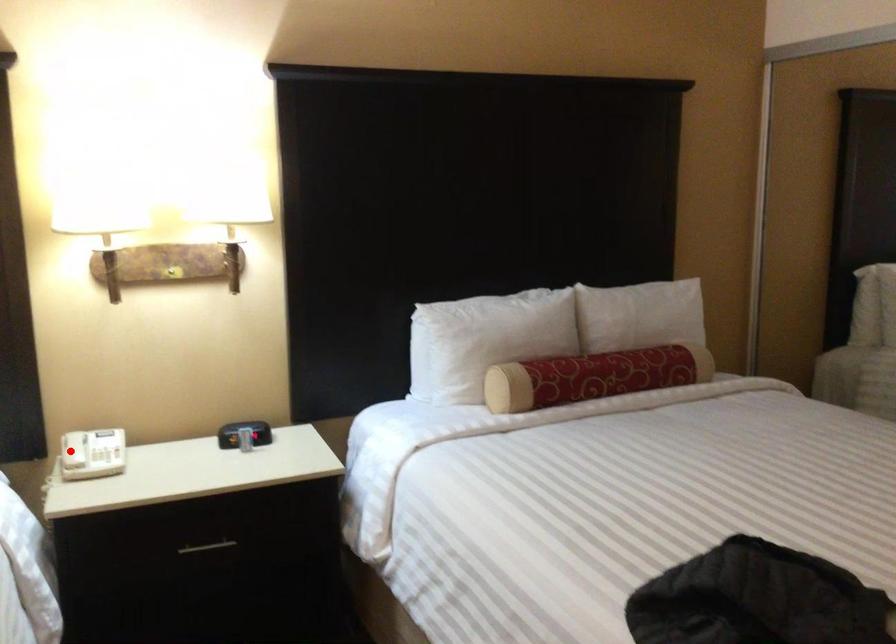
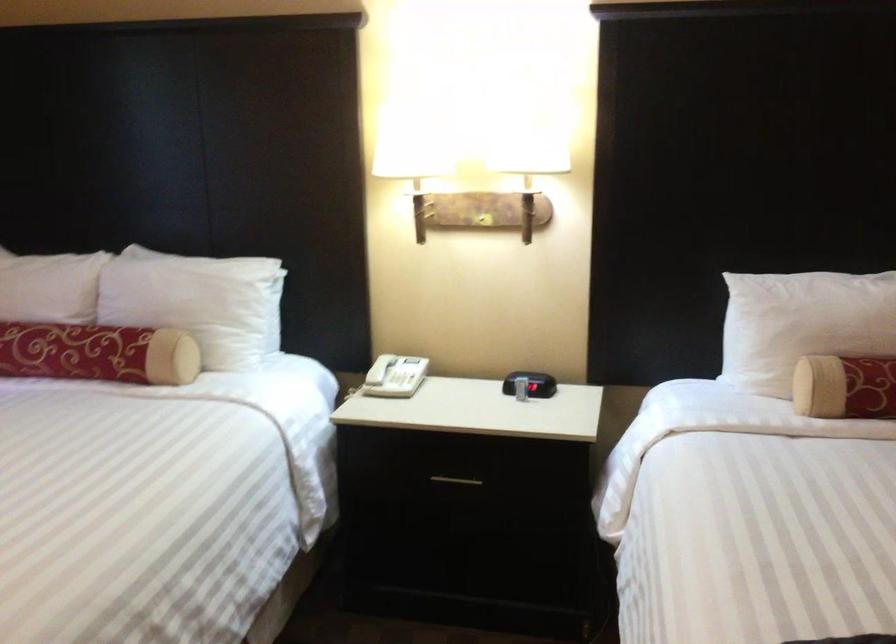
Question: I am providing you with two images of the same scene from different viewpoints. In image1, a red point is highlighted. Considering the same 3D point in image2, which of the following is correct?

Choices:
 (A) It is closer
 (B) It is farther

Answer: (B)